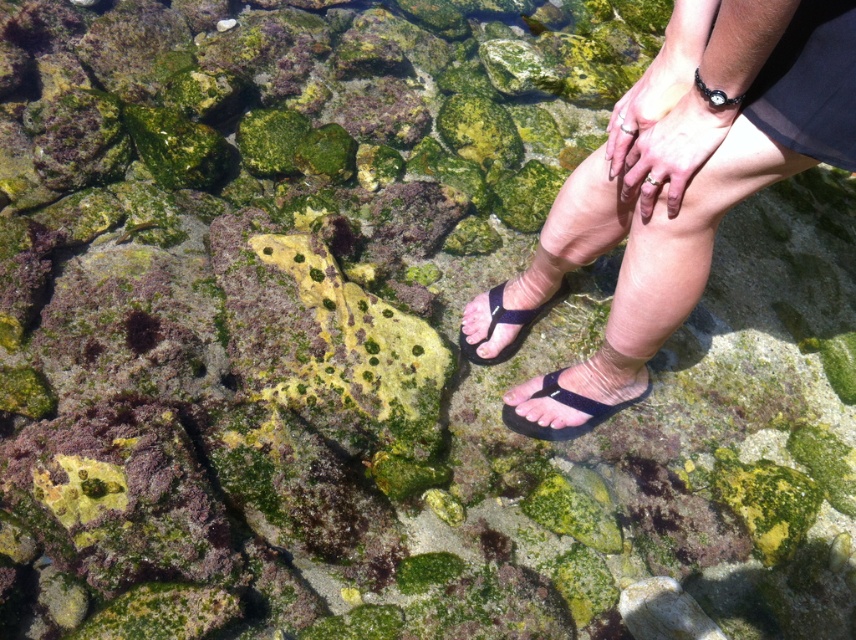
Question: Among these points, which one is nearest to the camera?

Choices:
 (A) (646, 305)
 (B) (496, 355)
 (C) (599, 417)

Answer: (A)

Question: Considering the real-world distances, which object is farthest from the black rubber sandals at lower center?

Choices:
 (A) black rubber flip-flop at center
 (B) black rubber sandal at lower right

Answer: (A)

Question: Does black rubber sandal at lower right come behind black rubber flip-flop at center?

Choices:
 (A) no
 (B) yes

Answer: (A)

Question: Can you confirm if black rubber sandals at lower center is positioned below black rubber sandal at lower right?

Choices:
 (A) no
 (B) yes

Answer: (A)

Question: Does black rubber sandal at lower right have a greater width compared to black rubber flip-flop at center?

Choices:
 (A) yes
 (B) no

Answer: (A)

Question: Considering the real-world distances, which object is closest to the black rubber sandals at lower center?

Choices:
 (A) black rubber sandal at lower right
 (B) black rubber flip-flop at center

Answer: (A)